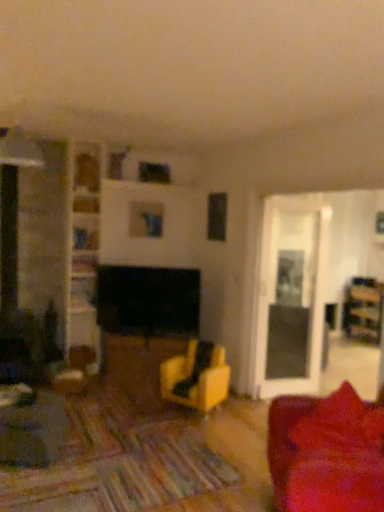
Question: From the image's perspective, is velvet red couch at lower right above or below wooden bookshelf at upper left, the second shelf from the top?

Choices:
 (A) below
 (B) above

Answer: (A)

Question: Would you say velvet red couch at lower right is to the left or to the right of wooden bookshelf at upper left, which is counted as the third shelf, starting from the bottom, in the picture?

Choices:
 (A) right
 (B) left

Answer: (A)

Question: Estimate the real-world distances between objects in this image. Which object is closer to the velvet red couch at lower right?

Choices:
 (A) matte yellow chair at center
 (B) wooden shelf at upper center, which ranks as the fourth shelf in bottom-to-top order
 (C) wooden bookshelf at upper left, the second shelf from the top
 (D) wooden bookshelf at left, which is the first shelf from bottom to top
 (E) wooden bookshelf at center, which is the second shelf in bottom-to-top order

Answer: (A)

Question: Estimate the real-world distances between objects in this image. Which object is farther from the velvet red couch at lower right?

Choices:
 (A) matte wood table at center
 (B) wooden shelf at upper center, which ranks as the fourth shelf in bottom-to-top order
 (C) wooden bookshelf at left, the fourth shelf when ordered from top to bottom
 (D) matte yellow chair at center
 (E) wooden bookshelf at right

Answer: (E)